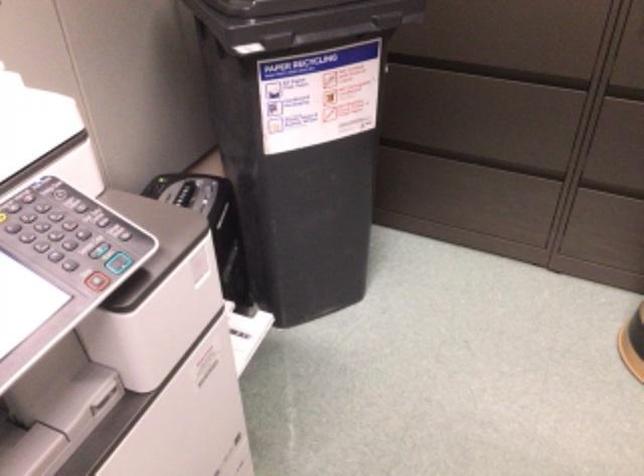
I want to click on black shredder lever, so click(182, 192).